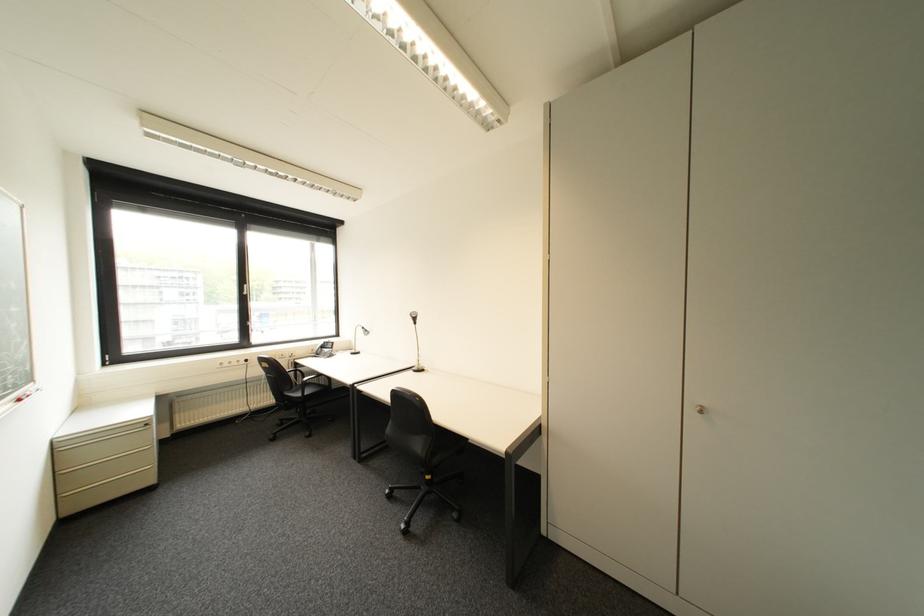
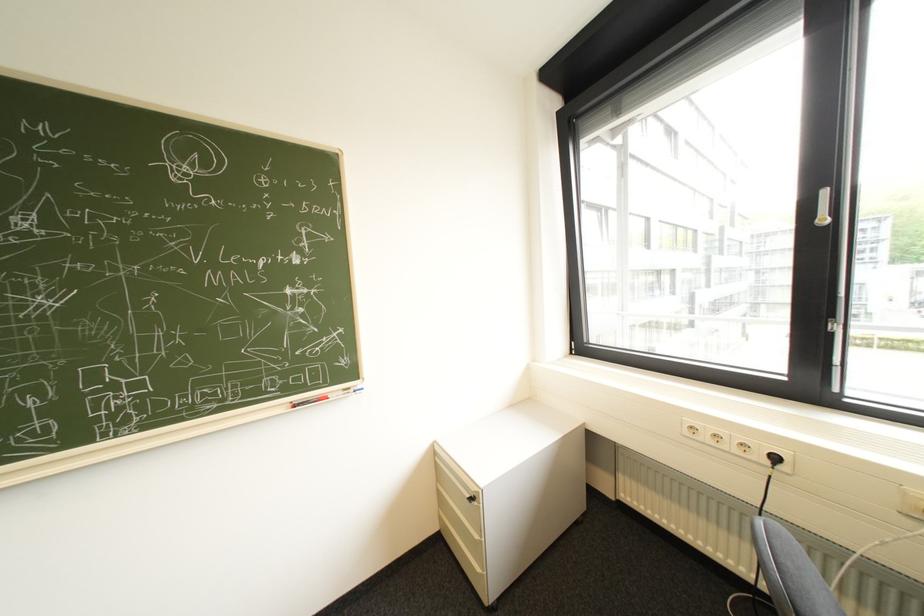
The point at (237, 365) is marked in the first image. Where is the corresponding point in the second image?

(715, 438)